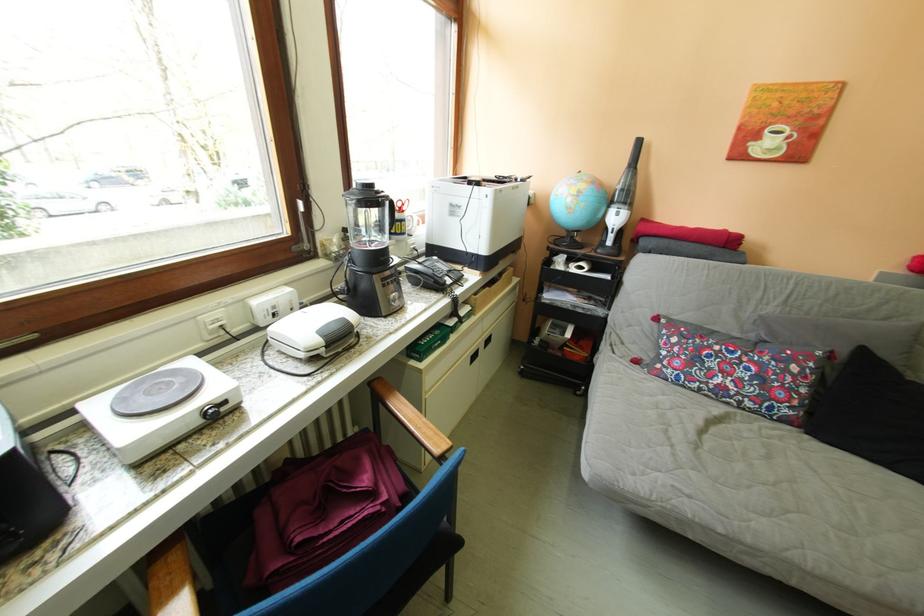
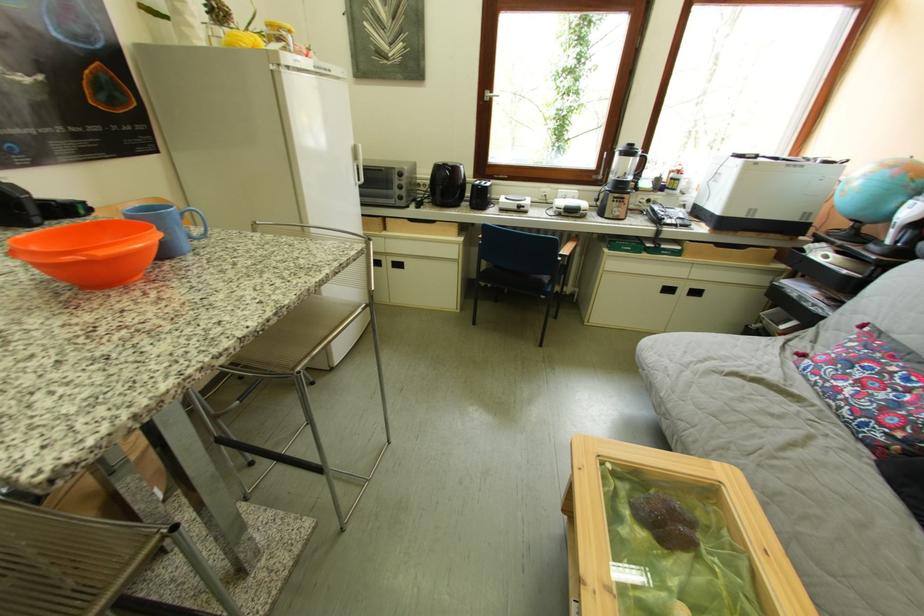
Locate, in the second image, the point that corresponds to (x=480, y=310) in the first image.

(690, 251)